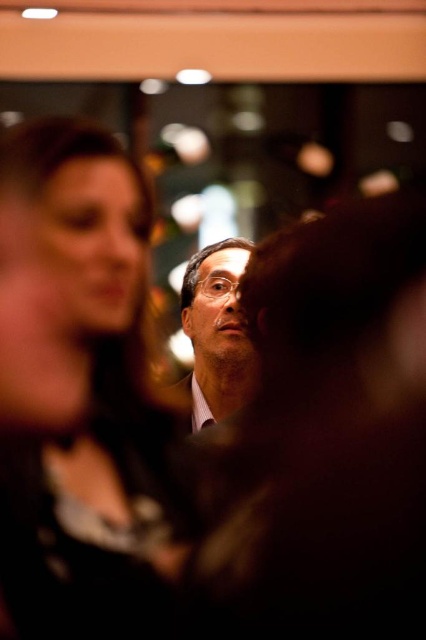
Question: Which point is farther to the camera?

Choices:
 (A) matte black dress at upper left
 (B) matte black glasses at center

Answer: (B)

Question: Can you confirm if matte black dress at upper left is wider than matte black glasses at center?

Choices:
 (A) yes
 (B) no

Answer: (A)

Question: Can you confirm if matte black dress at upper left is positioned below matte black glasses at center?

Choices:
 (A) no
 (B) yes

Answer: (B)

Question: Is matte black dress at upper left thinner than matte black glasses at center?

Choices:
 (A) no
 (B) yes

Answer: (A)

Question: Which point is farther to the camera?

Choices:
 (A) matte black glasses at center
 (B) matte black dress at upper left

Answer: (A)